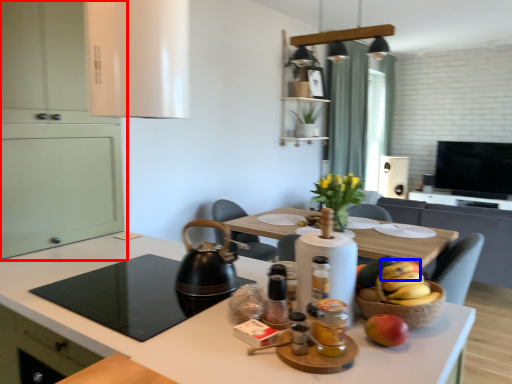
Question: Among these objects, which one is nearest to the camera, cabinetry (highlighted by a red box) or banana (highlighted by a blue box)?

Choices:
 (A) cabinetry
 (B) banana

Answer: (B)